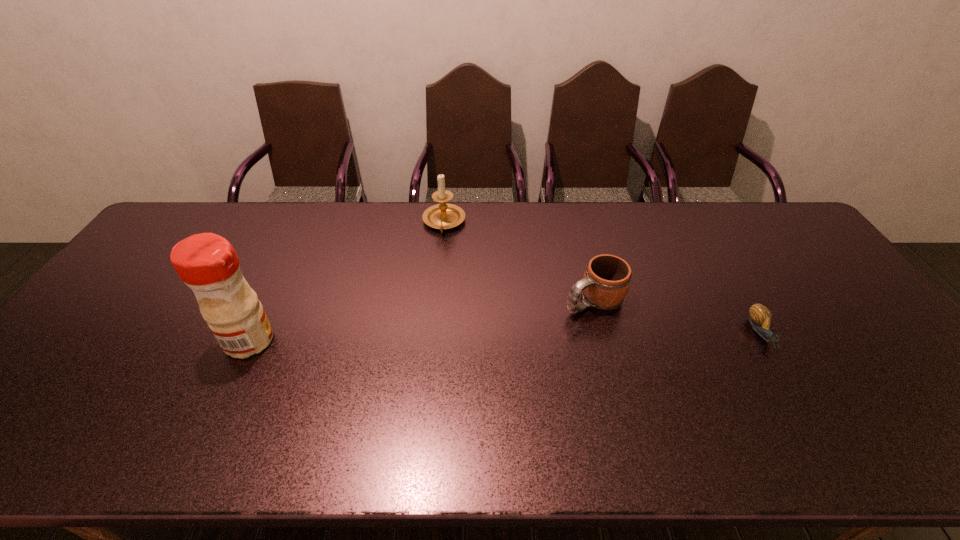
In the image, there is a desktop. At what (x,y) coordinates should I click in order to perform the action: click on vacant space at the far right corner. Please return your answer as a coordinate pair (x, y). Looking at the image, I should click on (763, 218).

Locate an element on the screen. The width and height of the screenshot is (960, 540). vacant space in between the mug and the leftmost object is located at coordinates (421, 320).

Find the location of `vacant space that's between the shortest object and the mug`. vacant space that's between the shortest object and the mug is located at coordinates (678, 316).

You are a GUI agent. You are given a task and a screenshot of the screen. Output one action in this format:
    pyautogui.click(x=<x>, y=<y>)
    Task: Click on the vacant area that lies between the tallest object and the mug
    The image size is (960, 540).
    Given the screenshot: What is the action you would take?
    pyautogui.click(x=421, y=320)

At what (x,y) coordinates should I click in order to perform the action: click on free space between the second object from left to right and the third object from left to right. Please return your answer as a coordinate pair (x, y). This screenshot has height=540, width=960. Looking at the image, I should click on (518, 261).

This screenshot has width=960, height=540. I want to click on free point between the farthest object and the leftmost object, so click(x=348, y=282).

The width and height of the screenshot is (960, 540). Find the location of `free space between the escargot and the tallest object`. free space between the escargot and the tallest object is located at coordinates (506, 337).

At what (x,y) coordinates should I click in order to perform the action: click on unoccupied area between the condiment and the escargot. Please return your answer as a coordinate pair (x, y). The width and height of the screenshot is (960, 540). Looking at the image, I should click on (506, 337).

Locate which object ranks third in proximity to the candle holder. Please provide its 2D coordinates. Your answer should be formatted as a tuple, i.e. [(x, y)], where the tuple contains the x and y coordinates of a point satisfying the conditions above.

[(760, 317)]

Identify which object is the third closest to the candle holder. Please provide its 2D coordinates. Your answer should be formatted as a tuple, i.e. [(x, y)], where the tuple contains the x and y coordinates of a point satisfying the conditions above.

[(760, 317)]